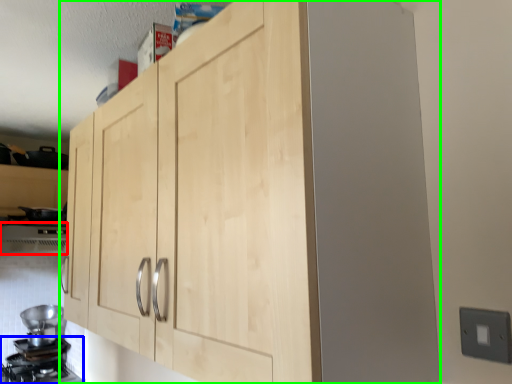
Question: Based on their relative distances, which object is farther from vent (highlighted by a red box)? Choose from gas stove (highlighted by a blue box) and cupboard (highlighted by a green box).

Choices:
 (A) gas stove
 (B) cupboard

Answer: (B)